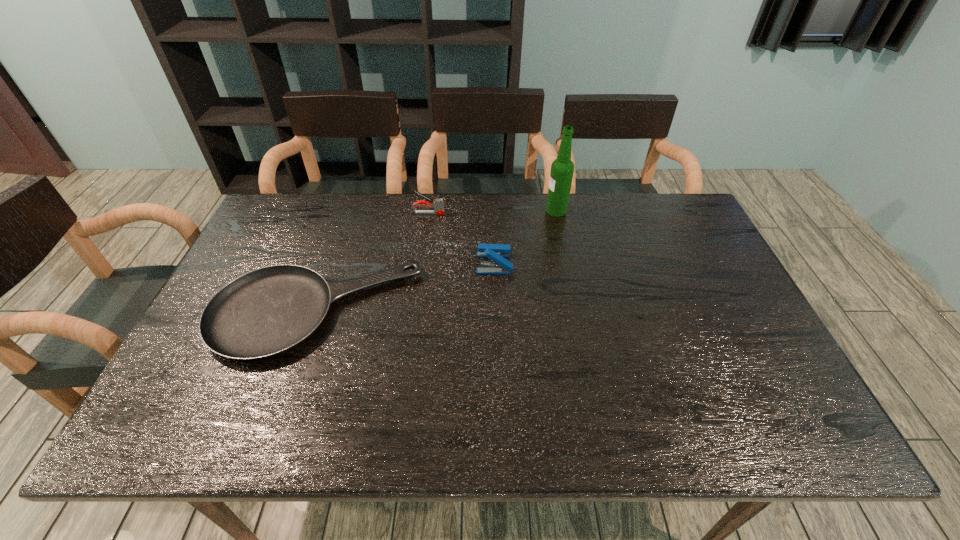
Where is `vacant space situated on the left of the right stapler`? Image resolution: width=960 pixels, height=540 pixels. vacant space situated on the left of the right stapler is located at coordinates (374, 263).

Find the location of a particular element. The width and height of the screenshot is (960, 540). vacant space positioned on the right of the shortest object is located at coordinates (536, 313).

I want to click on beer bottle at the far edge, so click(562, 169).

This screenshot has width=960, height=540. I want to click on stapler that is at the far edge, so click(x=438, y=205).

This screenshot has width=960, height=540. Identify the location of object located in the left edge section of the desktop. (265, 312).

Where is `free space at the far edge of the desktop`? Image resolution: width=960 pixels, height=540 pixels. free space at the far edge of the desktop is located at coordinates (425, 225).

Where is `vacant space at the near edge of the desktop`? vacant space at the near edge of the desktop is located at coordinates (432, 417).

Where is `vacant space at the left edge of the desktop`? The image size is (960, 540). vacant space at the left edge of the desktop is located at coordinates (206, 390).

At what (x,y) coordinates should I click in order to perform the action: click on free space at the far left corner of the desktop. Please return your answer as a coordinate pair (x, y). Looking at the image, I should click on (274, 226).

Find the location of a particular element. vacant space at the far right corner is located at coordinates click(x=656, y=220).